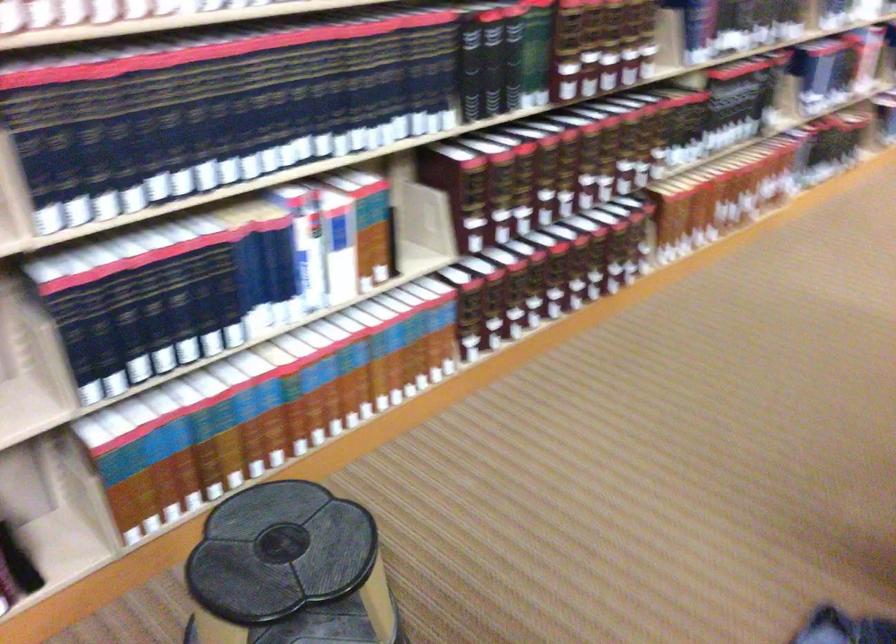
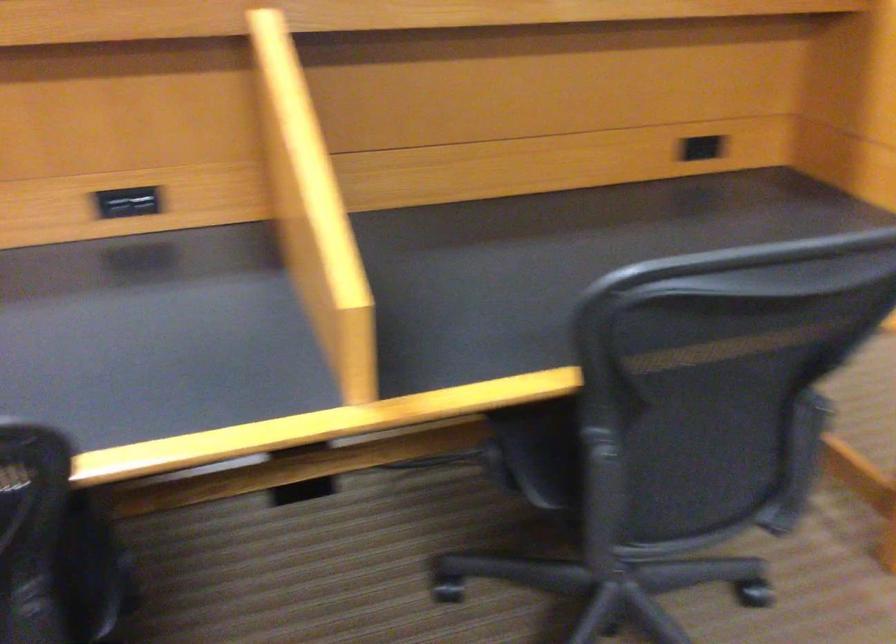
Question: I am providing you with two images of the same scene from different viewpoints. Which of the following objects are not visible in image2?

Choices:
 (A) black step stool
 (B) chair armrest
 (C) metal keyhole
 (D) chair sitting surface

Answer: (A)